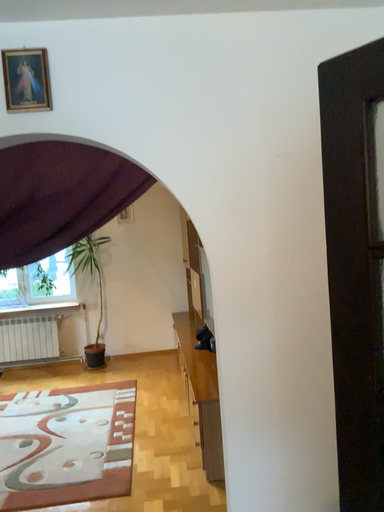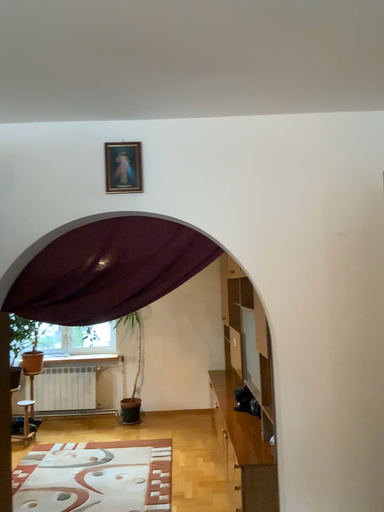
Question: Which way did the camera rotate in the video?

Choices:
 (A) rotated upward
 (B) rotated downward

Answer: (A)